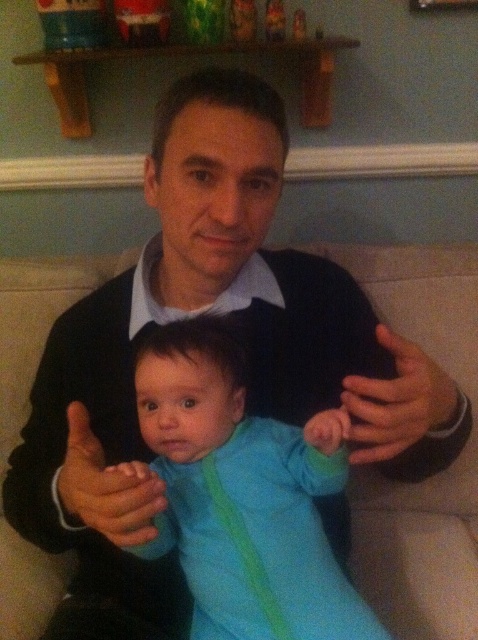
Can you confirm if blue fleece onesie at center is taller than blue fabric hand at center?

Yes, blue fleece onesie at center is taller than blue fabric hand at center.

Which is more to the right, blue fleece onesie at center or blue fabric hand at center?

Positioned to the right is blue fleece onesie at center.

Where is `blue fleece onesie at center`? blue fleece onesie at center is located at coordinates (242, 496).

You are a GUI agent. You are given a task and a screenshot of the screen. Output one action in this format:
    pyautogui.click(x=<x>, y=<y>)
    Task: Click on the blue fleece onesie at center
    This screenshot has width=478, height=640.
    Given the screenshot: What is the action you would take?
    pyautogui.click(x=242, y=496)